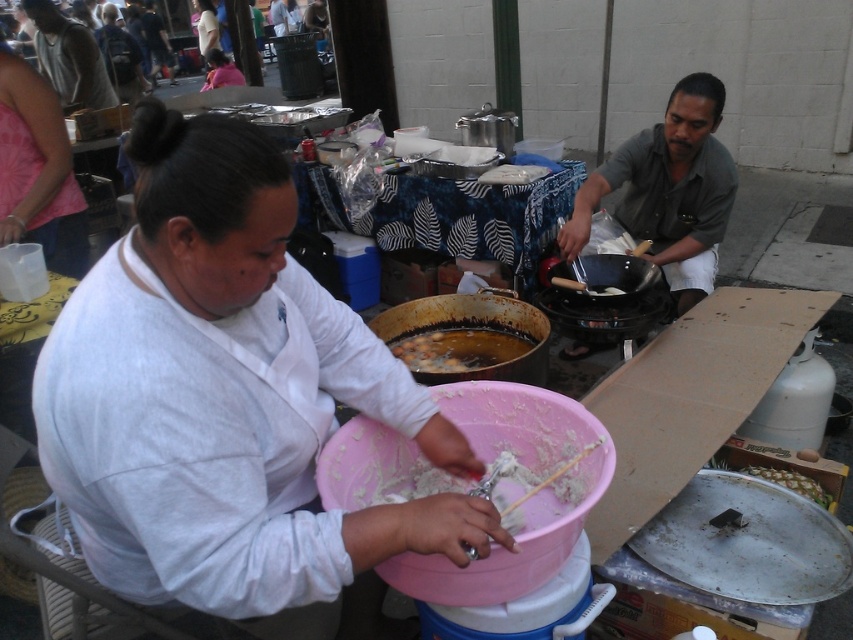
Question: Does pink fabric shirt at upper left have a lesser width compared to gray cotton shirt at upper left?

Choices:
 (A) no
 (B) yes

Answer: (B)

Question: Which object is positioned closest to the brown matte oil at center?

Choices:
 (A) pink matte bowl at center
 (B) pink fabric shirt at upper left
 (C) dark gray shirt at right

Answer: (A)

Question: Which of these objects is positioned farthest from the pink matte bowl at center?

Choices:
 (A) yellowish matte pineapple at lower right
 (B) white matte shirt at center
 (C) dark gray shirt at right

Answer: (C)

Question: Can you confirm if dark gray shirt at right is thinner than pink fabric shirt at upper left?

Choices:
 (A) no
 (B) yes

Answer: (A)

Question: Based on their relative distances, which object is farther from the pink fabric shirt at upper left?

Choices:
 (A) white matte shirt at center
 (B) yellowish matte pineapple at lower right

Answer: (B)

Question: Can you confirm if dark gray shirt at right is wider than pink fabric shirt at upper left?

Choices:
 (A) yes
 (B) no

Answer: (A)